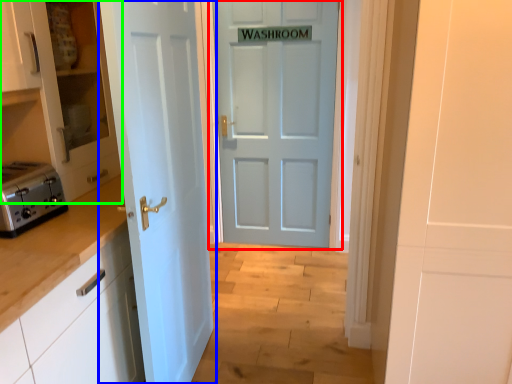
Question: Considering the real-world distances, which object is farthest from door (highlighted by a red box)? door (highlighted by a blue box) or cabinetry (highlighted by a green box)?

Choices:
 (A) door
 (B) cabinetry

Answer: (B)